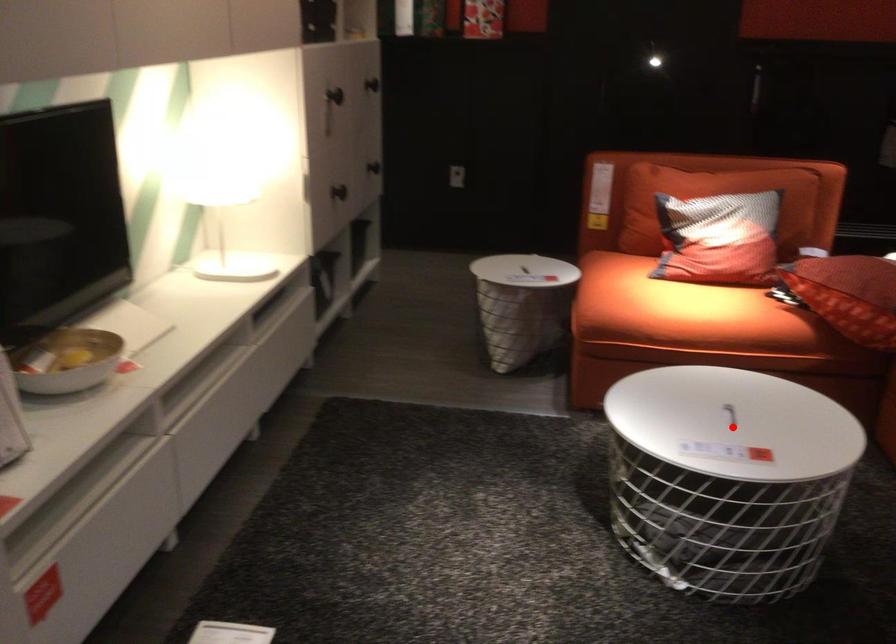
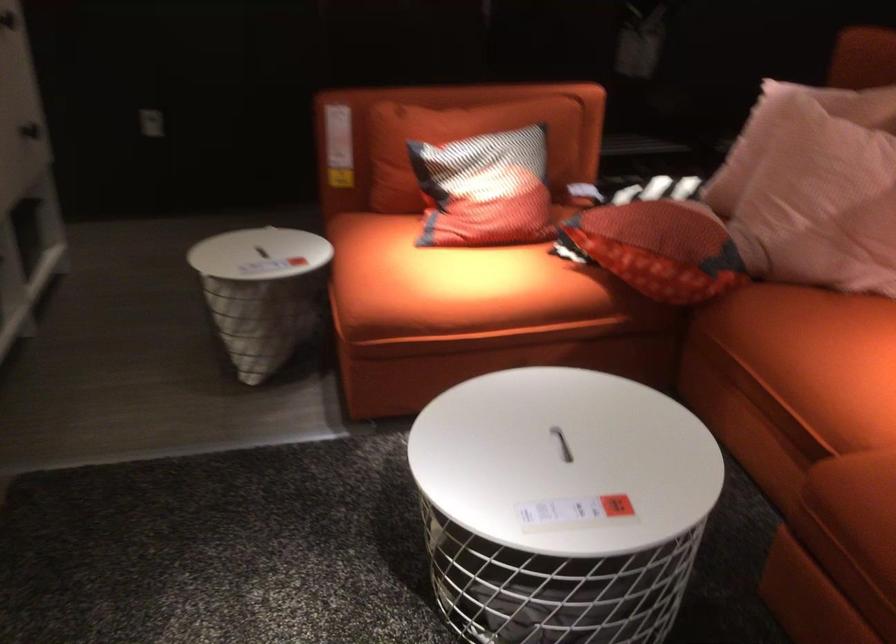
Where in the second image is the point corresponding to the highlighted location from the first image?

(562, 444)